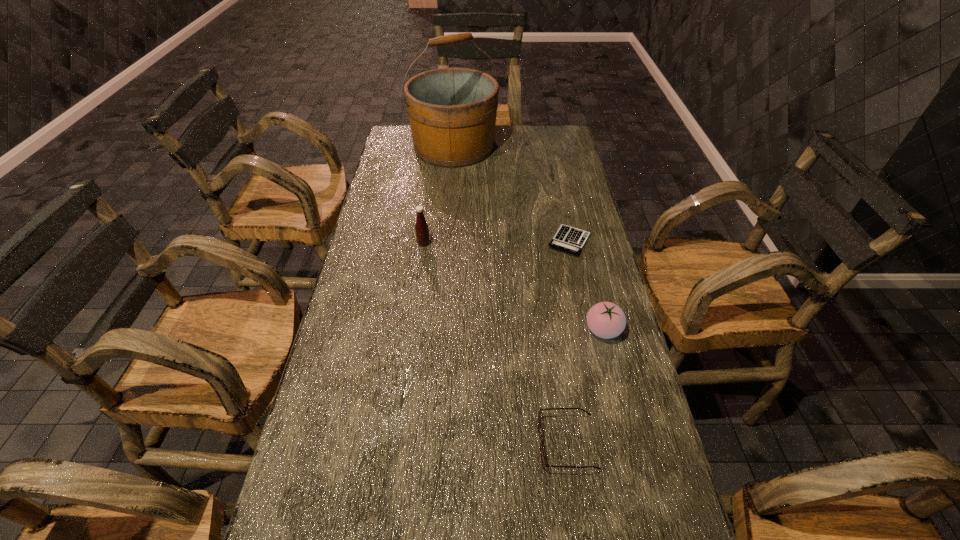
At what (x,y) coordinates should I click in order to perform the action: click on object that is at the far left corner. Please return your answer as a coordinate pair (x, y). This screenshot has width=960, height=540. Looking at the image, I should click on (452, 112).

The height and width of the screenshot is (540, 960). I want to click on free space at the left edge, so click(412, 156).

In the image, there is a desktop. Identify the location of free region at the right edge. This screenshot has width=960, height=540. (562, 306).

Where is `free space between the tomato and the Tabasco sauce`? free space between the tomato and the Tabasco sauce is located at coordinates (514, 287).

Find the location of a particular element. free spot between the tomato and the calculator is located at coordinates (587, 286).

I want to click on vacant space that's between the second shortest object and the tomato, so click(x=585, y=387).

Where is `free area in between the calculator and the spectacles`? free area in between the calculator and the spectacles is located at coordinates (568, 342).

Locate an element on the screen. The image size is (960, 540). free space that is in between the bucket and the fourth farthest object is located at coordinates (529, 238).

Image resolution: width=960 pixels, height=540 pixels. I want to click on blank region between the second tallest object and the third shortest object, so click(x=514, y=287).

This screenshot has height=540, width=960. Find the location of `empty space between the third shortest object and the shortest object`. empty space between the third shortest object and the shortest object is located at coordinates (587, 286).